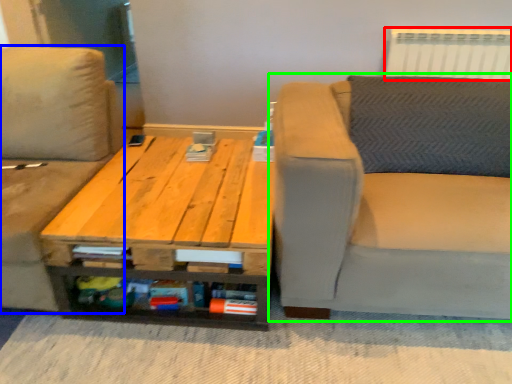
Question: Estimate the real-world distances between objects in this image. Which object is farther from radiator (highlighted by a red box), studio couch (highlighted by a blue box) or studio couch (highlighted by a green box)?

Choices:
 (A) studio couch
 (B) studio couch

Answer: (A)